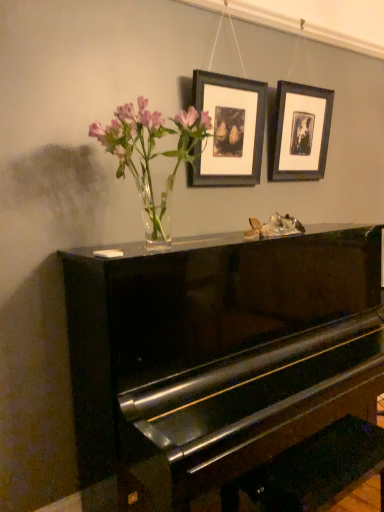
Question: Considering the positions of matte black picture frame at upper right, marked as the second picture frame in a left-to-right arrangement, and glossy black piano at center in the image, is matte black picture frame at upper right, marked as the second picture frame in a left-to-right arrangement, taller or shorter than glossy black piano at center?

Choices:
 (A) short
 (B) tall

Answer: (A)

Question: Considering the positions of matte black picture frame at upper right, marked as the second picture frame in a left-to-right arrangement, and glossy black piano at center in the image, is matte black picture frame at upper right, marked as the second picture frame in a left-to-right arrangement, wider or thinner than glossy black piano at center?

Choices:
 (A) thin
 (B) wide

Answer: (A)

Question: Which of these objects is positioned closest to the matte black picture frame at upper right, the 1th picture frame when ordered from right to left?

Choices:
 (A) glossy black piano at center
 (B) matte black picture frame at upper center, the first picture frame from the front
 (C) clear glass vase at upper center

Answer: (B)

Question: Estimate the real-world distances between objects in this image. Which object is farther from the glossy black piano at center?

Choices:
 (A) clear glass vase at upper center
 (B) matte black picture frame at upper center, the 2th picture frame positioned from the back
 (C) matte black picture frame at upper right, the 2th picture frame positioned from the front

Answer: (C)